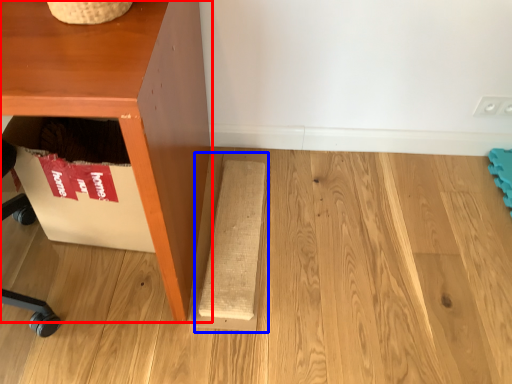
Question: Which object appears closest to the camera in this image, furniture (highlighted by a red box) or plank (highlighted by a blue box)?

Choices:
 (A) furniture
 (B) plank

Answer: (A)